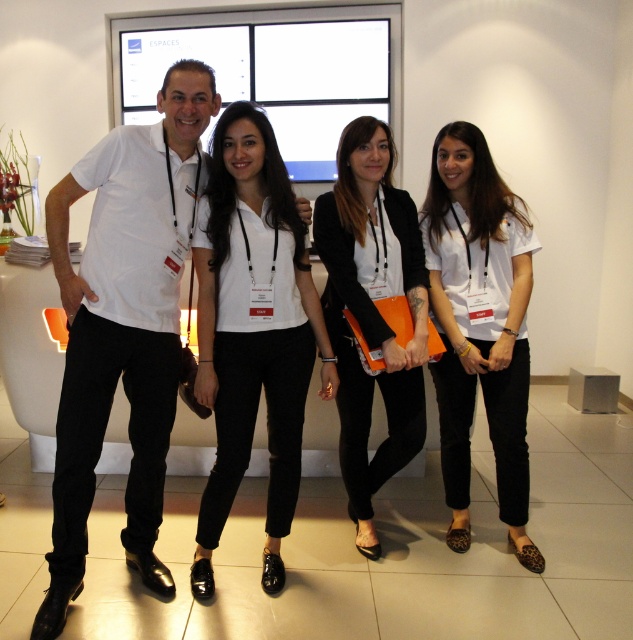
Does white smooth shirt at left have a smaller size compared to black leather jacket at center?

Actually, white smooth shirt at left might be larger than black leather jacket at center.

Is point (139, 262) farther from camera compared to point (410, 456)?

No, it is in front of (410, 456).

Who is more forward, (87,449) or (341,339)?

Point (87,449) is more forward.

Identify the location of white smooth shirt at left. The image size is (633, 640). (123, 324).

Locate an element on the screen. white matte shirt at center is located at coordinates (479, 324).

Is white matte shirt at center taller than black leather jacket at center?

Yes.

Is point (523, 392) farther from viewer compared to point (341, 134)?

Yes, it is behind point (341, 134).

Identify the location of white matte shirt at center. The width and height of the screenshot is (633, 640). (479, 324).

Which is below, white matte/black textured pants at center or black leather jacket at center?

white matte/black textured pants at center is below.

Is point (211, 301) farther from viewer compared to point (422, 413)?

No, it is not.

Is point (223, 305) closer to viewer compared to point (382, 188)?

Yes, point (223, 305) is closer to viewer.

You are a GUI agent. You are given a task and a screenshot of the screen. Output one action in this format:
    pyautogui.click(x=<x>, y=<y>)
    Task: Click on the white matte/black textured pants at center
    The height and width of the screenshot is (640, 633).
    Given the screenshot: What is the action you would take?
    pyautogui.click(x=253, y=330)